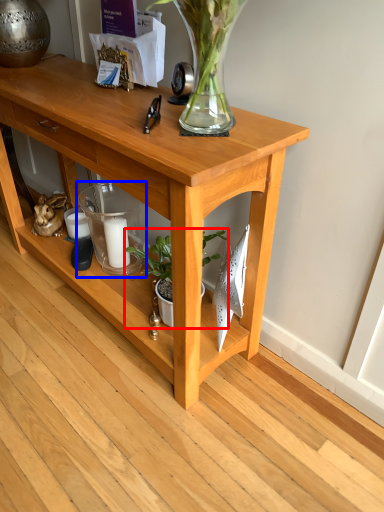
Question: Which object is further to the camera taking this photo, houseplant (highlighted by a red box) or candle holder (highlighted by a blue box)?

Choices:
 (A) houseplant
 (B) candle holder

Answer: (B)